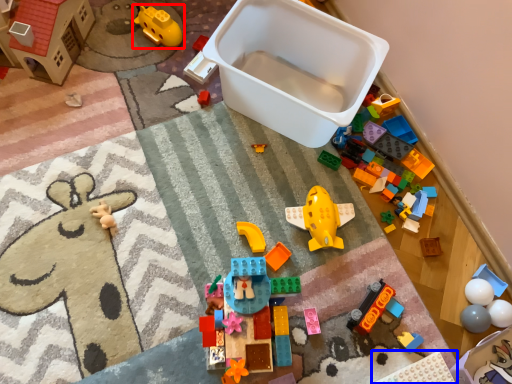
Question: Among these objects, which one is nearest to the camera, toy (highlighted by a red box) or toy (highlighted by a blue box)?

Choices:
 (A) toy
 (B) toy

Answer: (B)